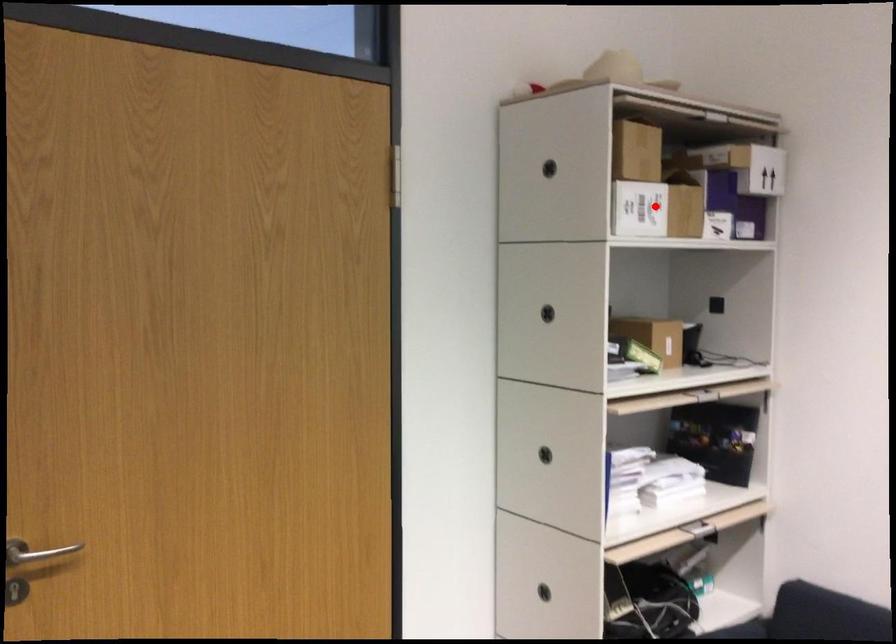
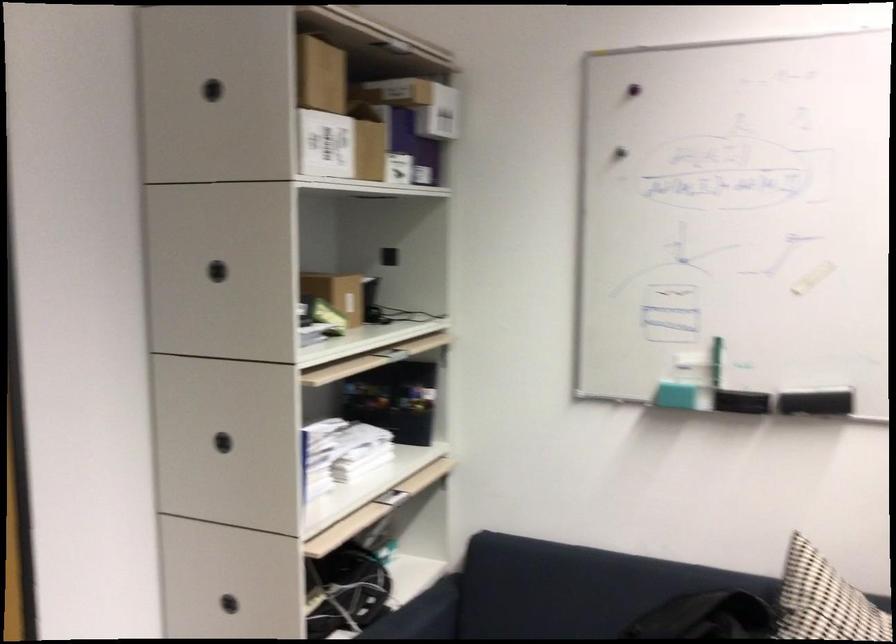
Question: I am providing you with two images of the same scene from different viewpoints. A red point is marked on the first image. Is the red point's position out of view in image 2?

Choices:
 (A) Yes
 (B) No

Answer: (B)